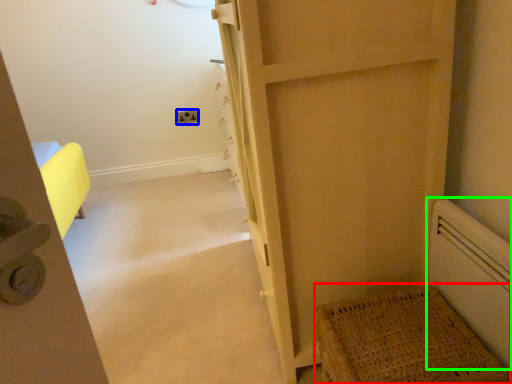
Question: Which is farther away from doormat (highlighted by a red box)? electric outlet (highlighted by a blue box) or radiator (highlighted by a green box)?

Choices:
 (A) electric outlet
 (B) radiator

Answer: (A)